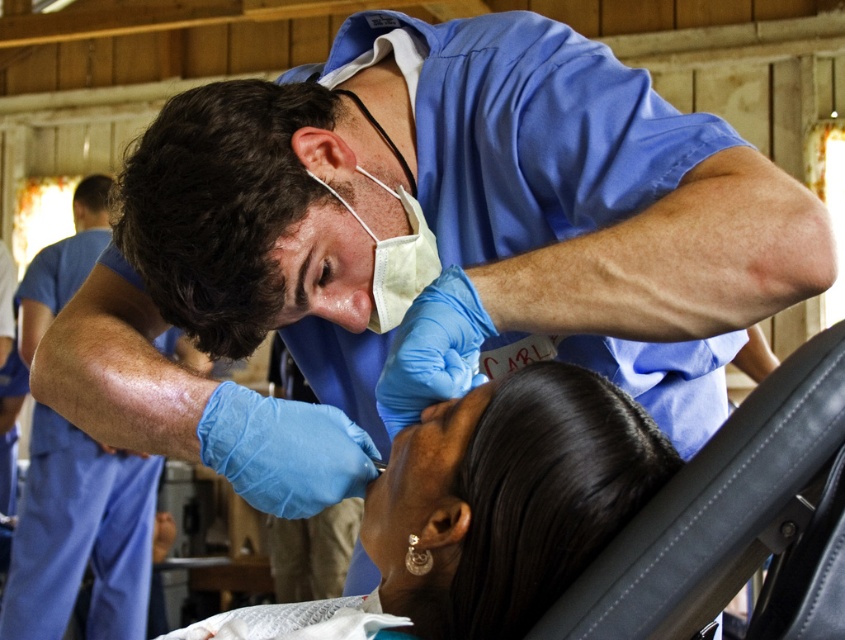
Question: Can you confirm if smooth skin face at center is smaller than white matte mask at upper center?

Choices:
 (A) no
 (B) yes

Answer: (A)

Question: Is smooth skin face at center further to the viewer compared to white matte mask at upper center?

Choices:
 (A) yes
 (B) no

Answer: (B)

Question: Is smooth skin face at center below white matte mask at upper center?

Choices:
 (A) no
 (B) yes

Answer: (B)

Question: Which object appears closest to the camera in this image?

Choices:
 (A) white matte mask at upper center
 (B) smooth skin face at center

Answer: (B)

Question: Which point appears closest to the camera in this image?

Choices:
 (A) (428, 544)
 (B) (398, 246)

Answer: (A)